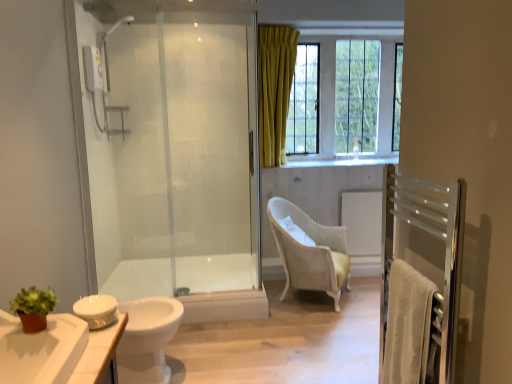
Question: From a real-world perspective, is white glossy faucet at upper center below white wicker chair at center?

Choices:
 (A) yes
 (B) no

Answer: (B)

Question: From the image's perspective, does white glossy faucet at upper center appear higher than white wicker chair at center?

Choices:
 (A) no
 (B) yes

Answer: (B)

Question: Is white glossy faucet at upper center to the left of white wicker chair at center from the viewer's perspective?

Choices:
 (A) no
 (B) yes

Answer: (A)

Question: Is white glossy faucet at upper center facing towards white wicker chair at center?

Choices:
 (A) no
 (B) yes

Answer: (A)

Question: From a real-world perspective, is white glossy faucet at upper center physically above white wicker chair at center?

Choices:
 (A) yes
 (B) no

Answer: (A)

Question: Does white glossy faucet at upper center contain white wicker chair at center?

Choices:
 (A) no
 (B) yes

Answer: (A)

Question: Is white wicker chair at center facing towards transparent glass shower door at left?

Choices:
 (A) yes
 (B) no

Answer: (B)

Question: Can you confirm if white wicker chair at center is positioned to the right of transparent glass shower door at left?

Choices:
 (A) yes
 (B) no

Answer: (A)

Question: Is white wicker chair at center thinner than transparent glass shower door at left?

Choices:
 (A) yes
 (B) no

Answer: (B)

Question: Can you confirm if white wicker chair at center is wider than transparent glass shower door at left?

Choices:
 (A) no
 (B) yes

Answer: (B)

Question: From the image's perspective, is white wicker chair at center under transparent glass shower door at left?

Choices:
 (A) yes
 (B) no

Answer: (A)

Question: From a real-world perspective, does white wicker chair at center sit lower than transparent glass shower door at left?

Choices:
 (A) no
 (B) yes

Answer: (B)

Question: Is matte glass window at upper right positioned beyond the bounds of white glossy cabinet at lower left?

Choices:
 (A) no
 (B) yes

Answer: (B)